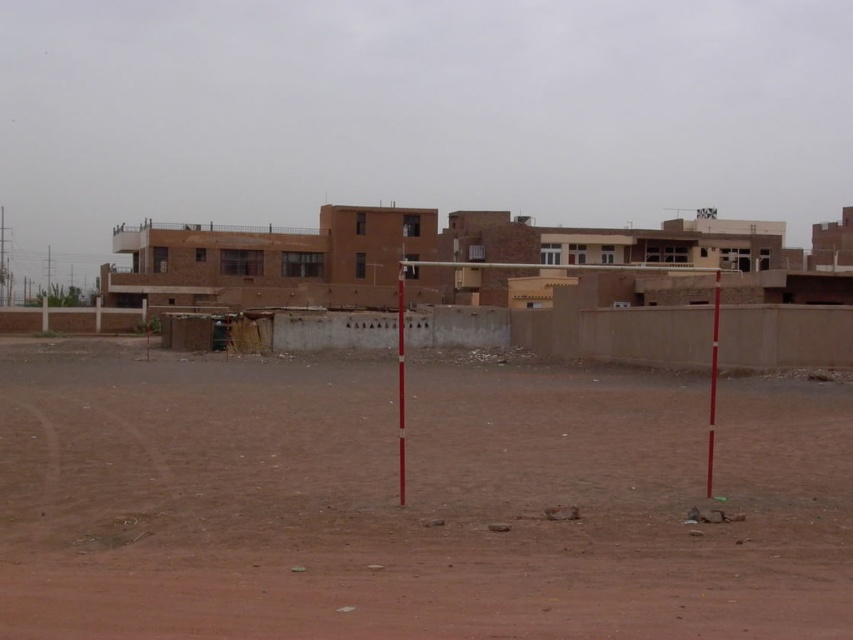
Question: Can you confirm if brown dirt field at center is positioned above brown concrete pole at center?

Choices:
 (A) no
 (B) yes

Answer: (A)

Question: Does brown dirt field at center appear under smooth wood pole at center?

Choices:
 (A) yes
 (B) no

Answer: (A)

Question: Which of the following is the closest to the observer?

Choices:
 (A) (714, 300)
 (B) (84, 496)

Answer: (B)

Question: Which point is farther to the camera?

Choices:
 (A) brown dirt field at center
 (B) smooth wood pole at center
 (C) brown concrete pole at center

Answer: (B)

Question: Can you confirm if brown concrete pole at center is positioned above smooth wood pole at center?

Choices:
 (A) no
 (B) yes

Answer: (B)

Question: Which object is the farthest from the smooth wood pole at center?

Choices:
 (A) brown dirt field at center
 (B) brown concrete pole at center

Answer: (B)